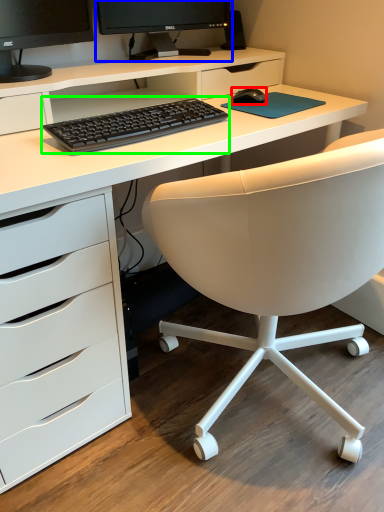
Question: Which is farther away from mouse (highlighted by a red box)? computer monitor (highlighted by a blue box) or computer keyboard (highlighted by a green box)?

Choices:
 (A) computer monitor
 (B) computer keyboard

Answer: (A)